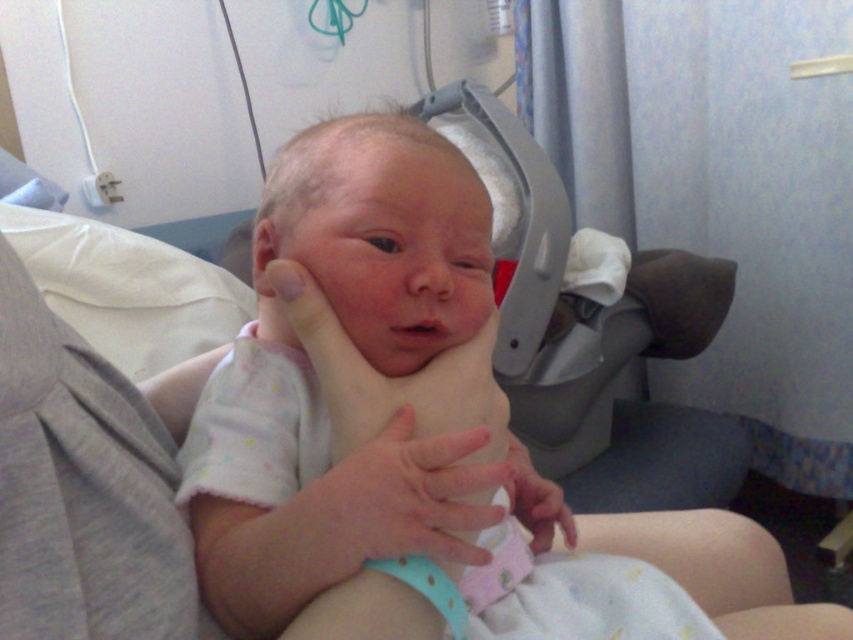
Question: Based on their relative distances, which object is nearer to the pink fabric at center?

Choices:
 (A) white cotton newborn at center
 (B) pink fabric hand at center

Answer: (B)

Question: Is pink fabric hand at center to the right of pink fabric at center from the viewer's perspective?

Choices:
 (A) yes
 (B) no

Answer: (B)

Question: Which of these objects is positioned farthest from the pink fabric hand at center?

Choices:
 (A) white cotton newborn at center
 (B) pink fabric at center

Answer: (A)

Question: Where is white cotton newborn at center located in relation to pink fabric hand at center in the image?

Choices:
 (A) above
 (B) below

Answer: (B)

Question: Is pink fabric hand at center further to camera compared to pink fabric at center?

Choices:
 (A) yes
 (B) no

Answer: (B)

Question: Which object is closer to the camera taking this photo?

Choices:
 (A) pink fabric hand at center
 (B) pink fabric at center
 (C) white cotton newborn at center

Answer: (A)